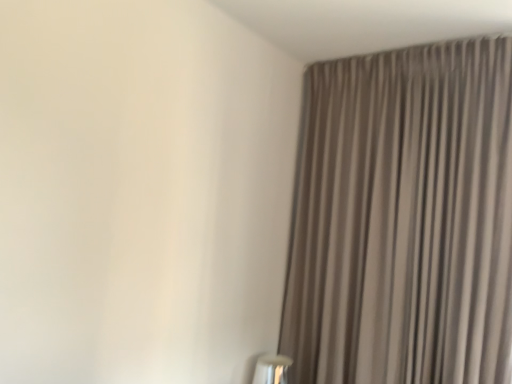
Describe the element at coordinates (403, 218) in the screenshot. I see `neutral striped curtain at right` at that location.

Locate an element on the screen. Image resolution: width=512 pixels, height=384 pixels. neutral striped curtain at right is located at coordinates (403, 218).

In order to face neutral striped curtain at right, should I rotate leftwards or rightwards?

To align with it, rotate right about 17.693°.

Describe the element at coordinates (272, 369) in the screenshot. I see `white glossy table lamp at lower right` at that location.

Measure the distance between point [287,361] and camera.

The depth of point [287,361] is 7.20 feet.

Identify the location of white glossy table lamp at lower right. (272, 369).

What are the coordinates of `neutral striped curtain at right` in the screenshot? It's located at (403, 218).

Considering the relative positions of white glossy table lamp at lower right and neutral striped curtain at right in the image provided, is white glossy table lamp at lower right to the left of neutral striped curtain at right from the viewer's perspective?

Yes, white glossy table lamp at lower right is to the left of neutral striped curtain at right.

In the image, is white glossy table lamp at lower right positioned in front of or behind neutral striped curtain at right?

In the image, white glossy table lamp at lower right appears behind neutral striped curtain at right.

Which point is more forward, [257,365] or [400,214]?

Positioned in front is point [400,214].

From the image's perspective, is white glossy table lamp at lower right on neutral striped curtain at right?

Incorrect, from the image's perspective, white glossy table lamp at lower right is lower than neutral striped curtain at right.

From a real-world perspective, is white glossy table lamp at lower right positioned over neutral striped curtain at right based on gravity?

Actually, white glossy table lamp at lower right is physically below neutral striped curtain at right in the real world.

Which object is wider, white glossy table lamp at lower right or neutral striped curtain at right?

Wider between the two is neutral striped curtain at right.

Between white glossy table lamp at lower right and neutral striped curtain at right, which one has less height?

Standing shorter between the two is white glossy table lamp at lower right.

Who is bigger, white glossy table lamp at lower right or neutral striped curtain at right?

neutral striped curtain at right.

Do you think white glossy table lamp at lower right is within neutral striped curtain at right, or outside of it?

white glossy table lamp at lower right is spatially situated outside neutral striped curtain at right.

Are white glossy table lamp at lower right and neutral striped curtain at right far apart?

No, white glossy table lamp at lower right is in close proximity to neutral striped curtain at right.

Is white glossy table lamp at lower right oriented away from neutral striped curtain at right?

That's not correct — white glossy table lamp at lower right is not looking away from neutral striped curtain at right.

At what (x,y) coordinates should I click in order to perform the action: click on table lamp on the left of neutral striped curtain at right. Please return your answer as a coordinate pair (x, y). The image size is (512, 384). Looking at the image, I should click on (272, 369).

Which object is positioned more to the left, neutral striped curtain at right or white glossy table lamp at lower right?

white glossy table lamp at lower right is more to the left.

Is neutral striped curtain at right positioned in front of white glossy table lamp at lower right?

Yes, neutral striped curtain at right is in front of white glossy table lamp at lower right.

Is point (435, 226) closer or farther from the camera than point (267, 374)?

Point (435, 226) is positioned closer to the camera compared to point (267, 374).

From the image's perspective, which object appears higher, neutral striped curtain at right or white glossy table lamp at lower right?

neutral striped curtain at right.

From a real-world perspective, is neutral striped curtain at right under white glossy table lamp at lower right?

No, from a real-world perspective, neutral striped curtain at right is not below white glossy table lamp at lower right.

Which object is thinner, neutral striped curtain at right or white glossy table lamp at lower right?

With smaller width is white glossy table lamp at lower right.

Considering the relative sizes of neutral striped curtain at right and white glossy table lamp at lower right in the image provided, is neutral striped curtain at right taller than white glossy table lamp at lower right?

Correct, neutral striped curtain at right is much taller as white glossy table lamp at lower right.

Is neutral striped curtain at right bigger than white glossy table lamp at lower right?

Yes.

Is neutral striped curtain at right surrounding white glossy table lamp at lower right?

No.

Is neutral striped curtain at right positioned far away from white glossy table lamp at lower right?

No, neutral striped curtain at right is not far away from white glossy table lamp at lower right.

Is neutral striped curtain at right aimed at white glossy table lamp at lower right?

Yes, neutral striped curtain at right is turned towards white glossy table lamp at lower right.

Where is `table lamp to the left of neutral striped curtain at right`? This screenshot has width=512, height=384. table lamp to the left of neutral striped curtain at right is located at coordinates [272, 369].

Where is `curtain above the white glossy table lamp at lower right (from a real-world perspective)`? The height and width of the screenshot is (384, 512). curtain above the white glossy table lamp at lower right (from a real-world perspective) is located at coordinates (403, 218).

You are a GUI agent. You are given a task and a screenshot of the screen. Output one action in this format:
    pyautogui.click(x=<x>, y=<y>)
    Task: Click on the table lamp that appears below the neutral striped curtain at right (from the image's perspective)
    Image resolution: width=512 pixels, height=384 pixels.
    Given the screenshot: What is the action you would take?
    pyautogui.click(x=272, y=369)